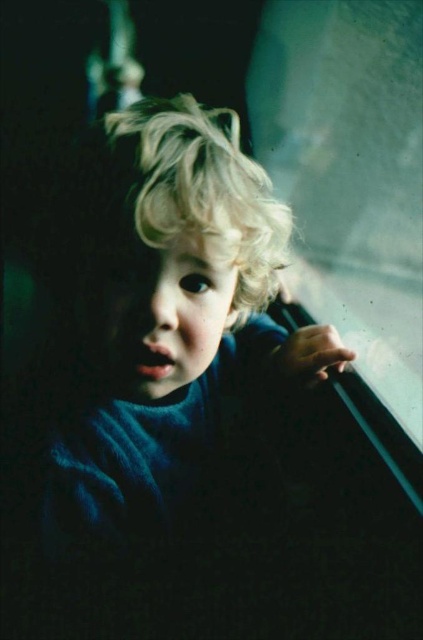
The child is wearing a blue woolen sweater at center and there is a transparent glass train window at upper right. Which object is positioned higher in the image?

The transparent glass train window at upper right is positioned higher than the blue woolen sweater at center.

You are a photographer trying to capture the child in the scene. The child is leaning against the transparent glass train window at upper right and has blonde curly hair at center. Since the window is transparent, could the photographer see the child through the window?

The blonde curly hair at center is behind the transparent glass train window at upper right, so the photographer can see the child through the window as the window is transparent.

Looking at this image, you are a photographer trying to capture the child in the scene. Since the blue woolen sweater at center and the transparent glass train window at upper right are both in view, which object should you focus on to ensure the child remains the main subject?

The blue woolen sweater at center should be focused on because it occupies less space than the transparent glass train window at upper right, making it easier to keep the child as the main subject without the window overshadowing them.